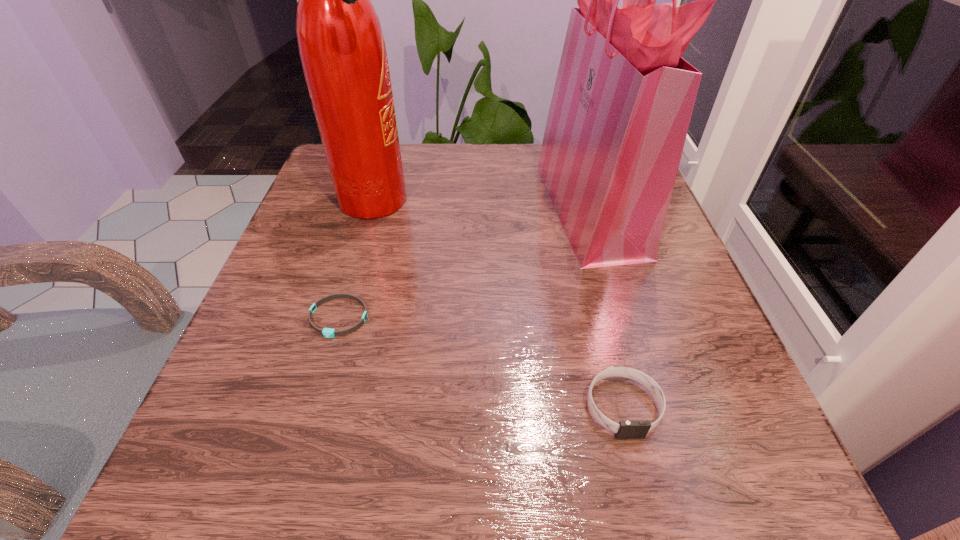
At what (x,y) coordinates should I click in order to perform the action: click on free spot between the shopping bag and the right wristband. Please return your answer as a coordinate pair (x, y). This screenshot has height=540, width=960. Looking at the image, I should click on (607, 306).

Identify the location of free area in between the taller wristband and the shortest object. pos(481,362).

Locate an element on the screen. The image size is (960, 540). vacant region between the taller wristband and the left wristband is located at coordinates (481, 362).

At what (x,y) coordinates should I click in order to perform the action: click on free space between the shopping bag and the nearer wristband. Please return your answer as a coordinate pair (x, y). Image resolution: width=960 pixels, height=540 pixels. Looking at the image, I should click on (607, 306).

You are a GUI agent. You are given a task and a screenshot of the screen. Output one action in this format:
    pyautogui.click(x=<x>, y=<y>)
    Task: Click on the third closest object to the shopping bag
    The width and height of the screenshot is (960, 540).
    Given the screenshot: What is the action you would take?
    (x=327, y=332)

Where is `object that is the third closest to the shopping bag`? object that is the third closest to the shopping bag is located at coordinates (327, 332).

Find the location of a particular element. The image size is (960, 540). vacant area in the image that satisfies the following two spatial constraints: 1. on the front side of the fire extinguisher; 2. on the left side of the shopping bag is located at coordinates (372, 205).